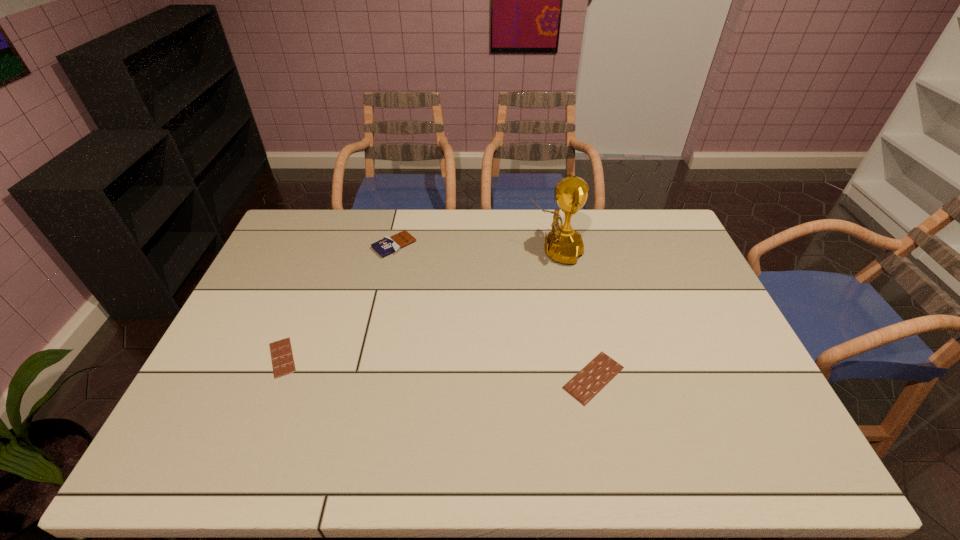
Locate an element on the screen. free space between the second tallest chocolate bar and the leftmost chocolate bar is located at coordinates (438, 368).

Image resolution: width=960 pixels, height=540 pixels. Find the location of `free space between the tallest object and the shortest chocolate bar`. free space between the tallest object and the shortest chocolate bar is located at coordinates (419, 304).

At what (x,y) coordinates should I click in order to perform the action: click on vacant space that's between the shortest object and the second chocolate bar from right to left. Please return your answer as a coordinate pair (x, y). The image size is (960, 540). Looking at the image, I should click on (338, 301).

Locate an element on the screen. free space between the second tallest object and the second shortest chocolate bar is located at coordinates (493, 312).

You are a GUI agent. You are given a task and a screenshot of the screen. Output one action in this format:
    pyautogui.click(x=<x>, y=<y>)
    Task: Click on the vacant space that is in between the tallest object and the leftmost chocolate bar
    
    Given the screenshot: What is the action you would take?
    pyautogui.click(x=419, y=304)

Identify the location of vacant area that lies between the tallest object and the leftmost chocolate bar. Image resolution: width=960 pixels, height=540 pixels. (419, 304).

Locate an element on the screen. free point between the rightmost chocolate bar and the second tallest object is located at coordinates (493, 312).

Image resolution: width=960 pixels, height=540 pixels. I want to click on free space between the second tallest object and the tallest object, so click(474, 248).

Locate an element on the screen. Image resolution: width=960 pixels, height=540 pixels. vacant area between the rightmost chocolate bar and the shortest chocolate bar is located at coordinates (438, 368).

Identify the location of free space between the second tallest chocolate bar and the leftmost chocolate bar. (438, 368).